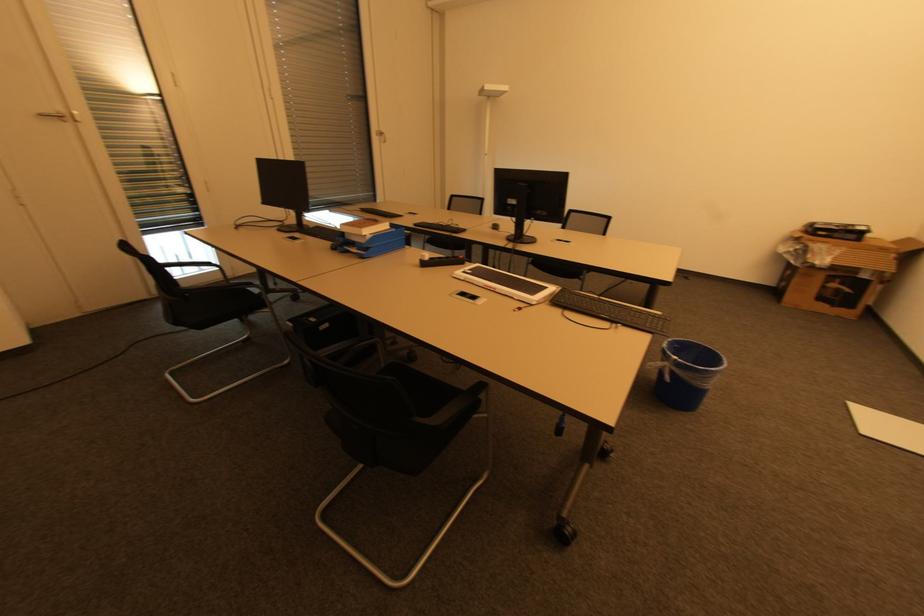
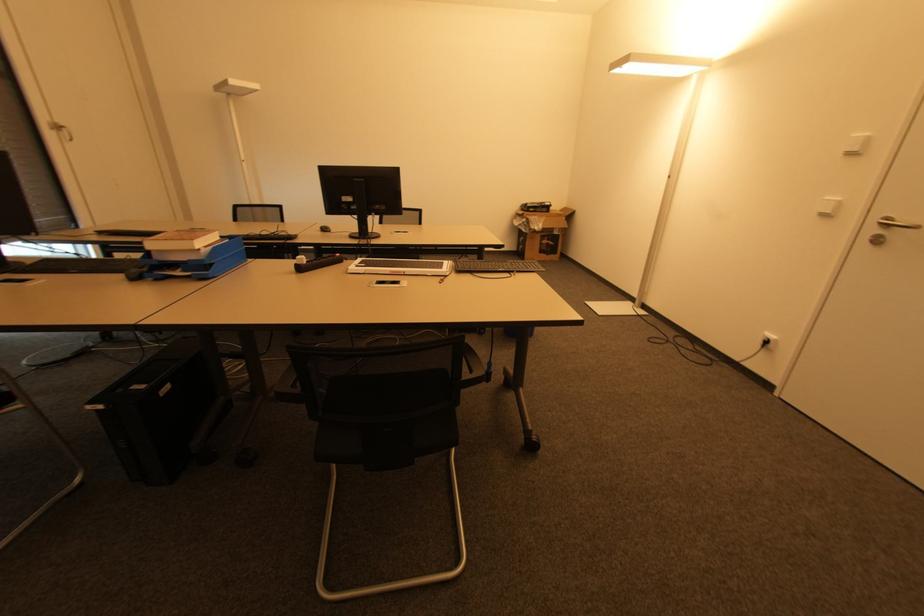
Question: I am providing you with two images of the same scene from different viewpoints. After the viewpoint changes to image2, which objects are now occluded?

Choices:
 (A) blue paper tray
 (B) white keyboard
 (C) stacked books
 (D) none of these

Answer: (D)